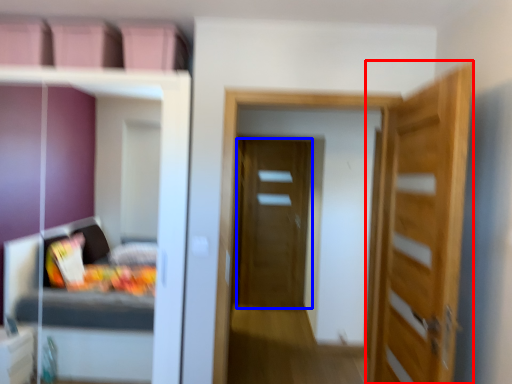
Question: Which of the following is the closest to the observer, door (highlighted by a red box) or door (highlighted by a blue box)?

Choices:
 (A) door
 (B) door

Answer: (A)